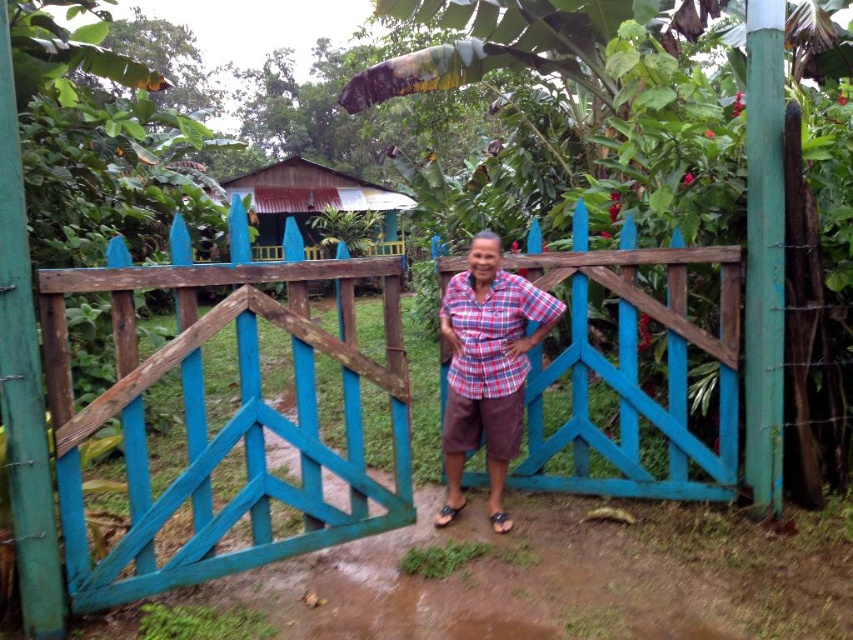
Is wooden gate at center thinner than rusty metal hut at center?

Correct, wooden gate at center's width is less than rusty metal hut at center's.

Is point (732, 481) behind point (260, 234)?

No, (732, 481) is in front of (260, 234).

Is point (606, 365) closer to viewer compared to point (383, 202)?

Yes, point (606, 365) is closer to viewer.

The image size is (853, 640). In order to click on wooden gate at center in this screenshot , I will do `click(631, 369)`.

Can you confirm if teal wooden gate at center is wider than plaid fabric shirt at center?

Yes.

This screenshot has width=853, height=640. Find the location of `teal wooden gate at center`. teal wooden gate at center is located at coordinates (231, 417).

Locate an element on the screen. Image resolution: width=853 pixels, height=640 pixels. teal wooden gate at center is located at coordinates click(x=231, y=417).

Is teal wooden gate at center to the left of wooden gate at center from the viewer's perspective?

Correct, you'll find teal wooden gate at center to the left of wooden gate at center.

Who is shorter, teal wooden gate at center or wooden gate at center?

wooden gate at center is shorter.

This screenshot has width=853, height=640. What do you see at coordinates (231, 417) in the screenshot?
I see `teal wooden gate at center` at bounding box center [231, 417].

Locate an element on the screen. teal wooden gate at center is located at coordinates [x=231, y=417].